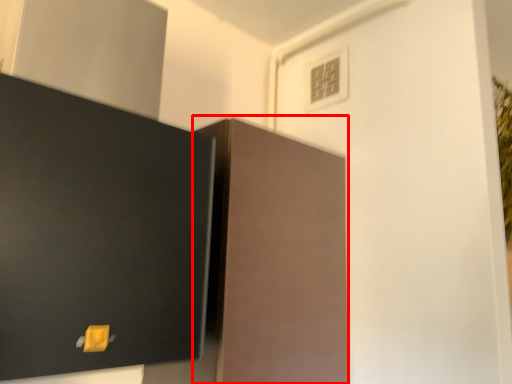
Question: Where is cabinetry (annotated by the red box) located in relation to light switch in the image?

Choices:
 (A) right
 (B) left

Answer: (B)